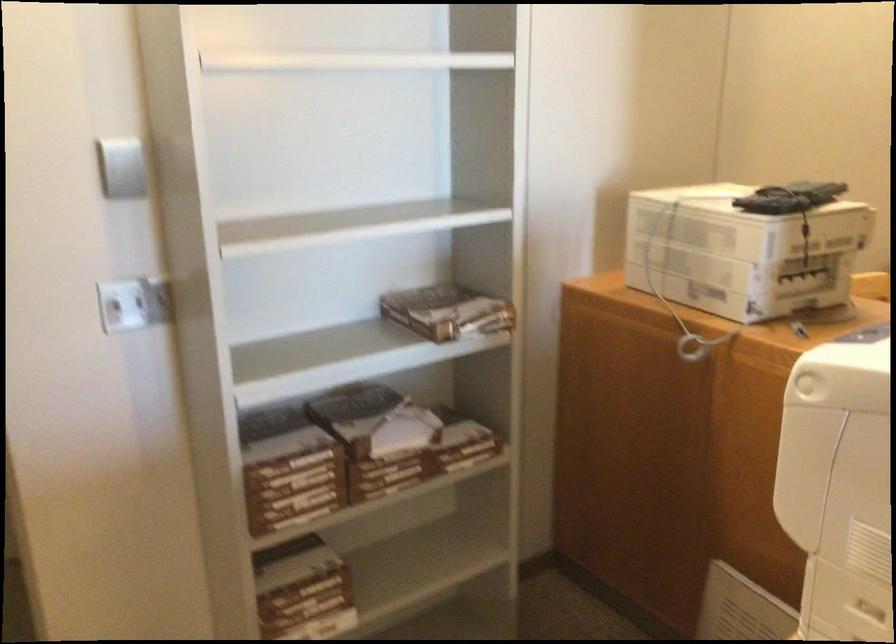
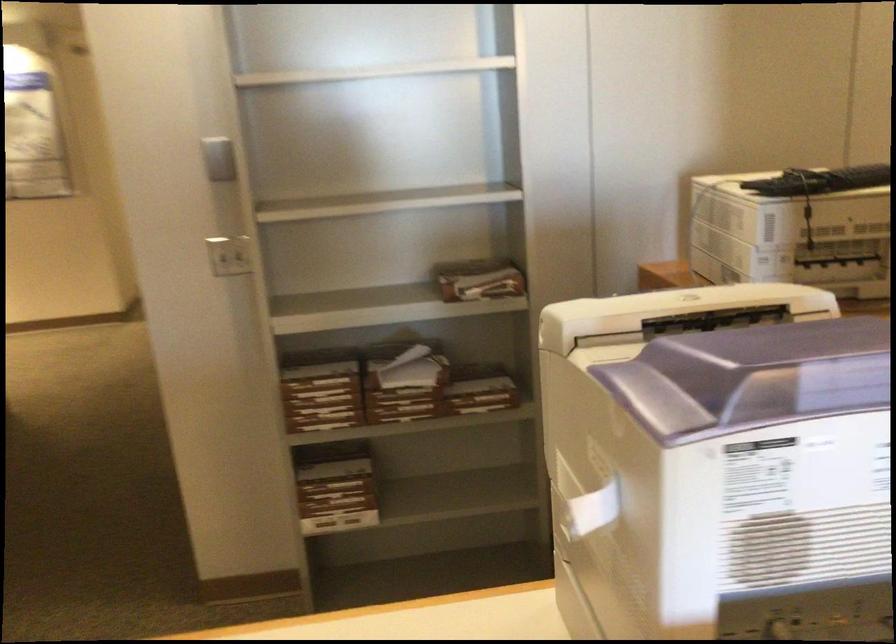
Locate, in the second image, the point that corresponds to pixel 384 457 in the first image.

(398, 389)